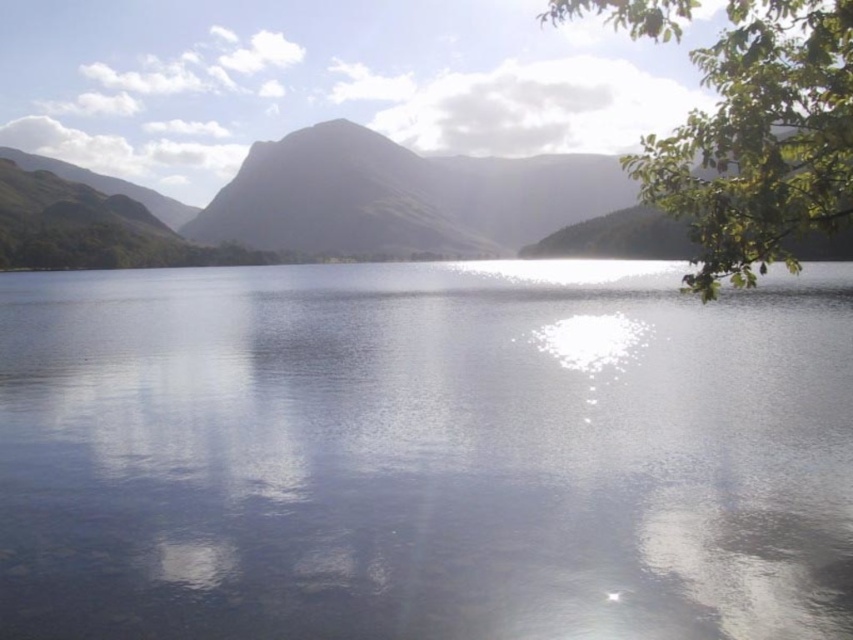
Question: Does clear water at center appear on the left side of green matte mountain at center?

Choices:
 (A) no
 (B) yes

Answer: (A)

Question: Which point is farther to the camera?

Choices:
 (A) green leafy branch at upper right
 (B) green matte mountain at center

Answer: (B)

Question: Which object is positioned farthest from the clear water at center?

Choices:
 (A) green matte mountain at center
 (B) green leafy branch at upper right

Answer: (A)

Question: Considering the real-world distances, which object is closest to the green leafy branch at upper right?

Choices:
 (A) green matte mountain at center
 (B) clear water at center

Answer: (B)

Question: Does clear water at center have a smaller size compared to green leafy branch at upper right?

Choices:
 (A) yes
 (B) no

Answer: (A)

Question: Is clear water at center positioned at the back of green matte mountain at center?

Choices:
 (A) no
 (B) yes

Answer: (A)